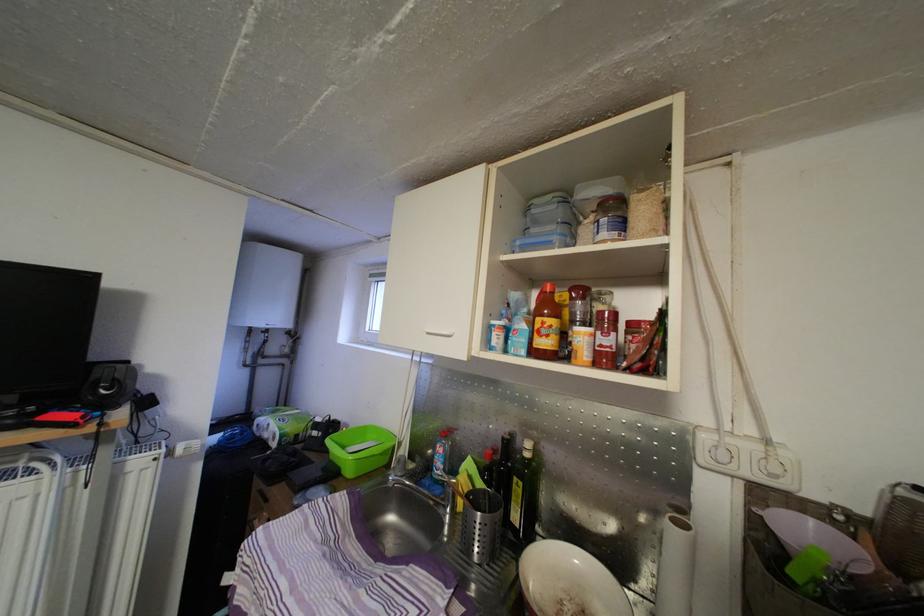
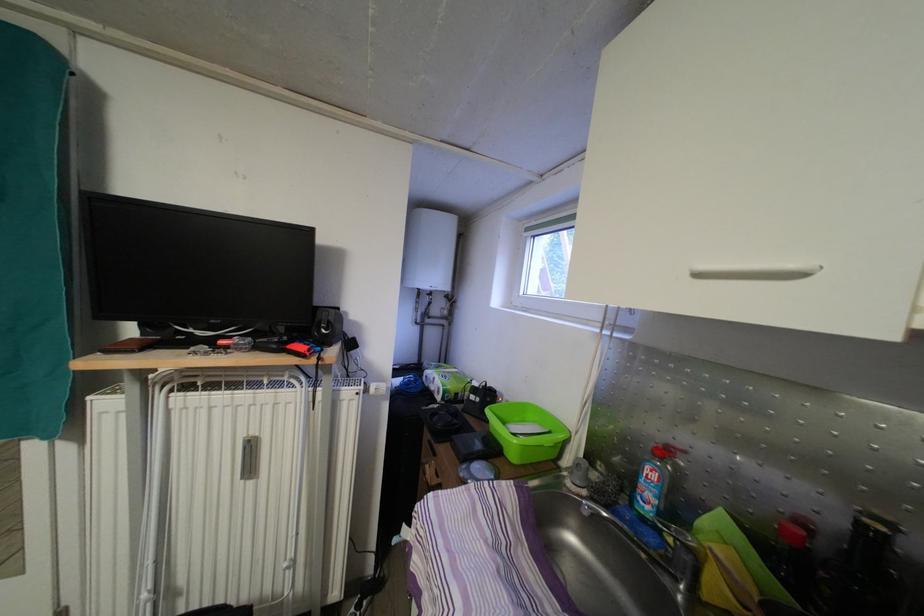
Where in the second image is the point corresponding to (x=104, y=387) from the first image?

(326, 329)